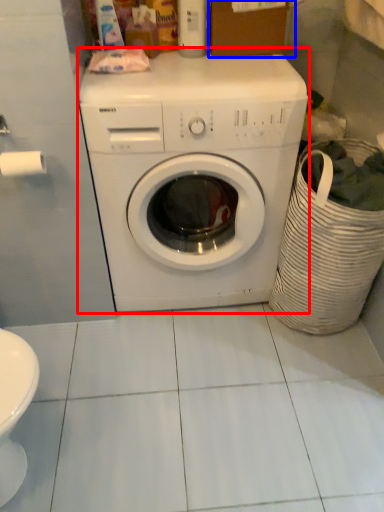
Question: Which object appears closest to the camera in this image, washing machine (highlighted by a red box) or cardboard box (highlighted by a blue box)?

Choices:
 (A) washing machine
 (B) cardboard box

Answer: (A)